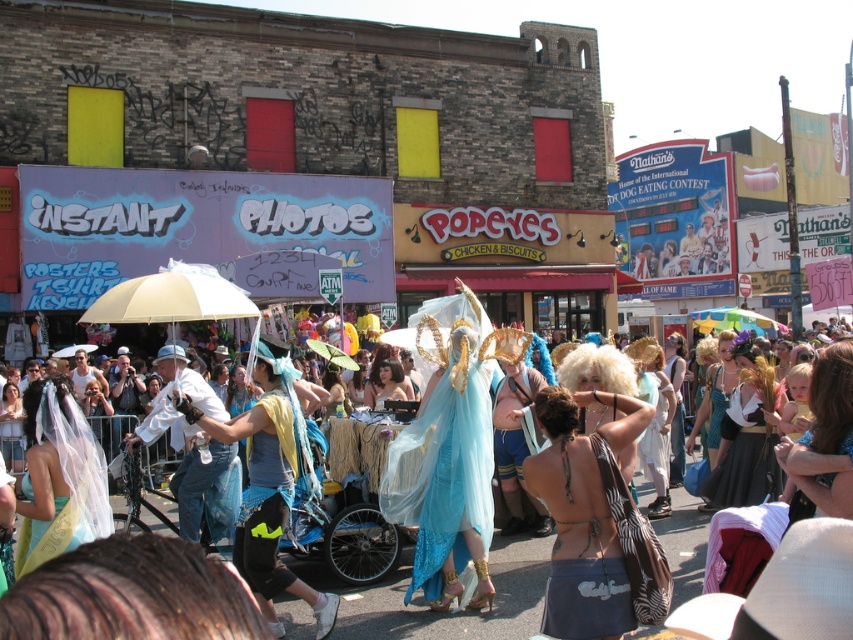
You are standing in the middle of the crowd and see both the white matte umbrella at center and the rainbow fabric umbrella at center. Which one is nearer to you?

The white matte umbrella at center is closer to the viewer than the rainbow fabric umbrella at center, so the white matte umbrella at center is nearer to you.

You are a photographer trying to capture the entire scene of the blue fabric dress at center and the rainbow fabric umbrella at center in one shot. Given that the umbrella is larger, which object should you focus on to ensure both are in frame without cropping?

The blue fabric dress at center is smaller than the rainbow fabric umbrella at center, so you should focus on the rainbow fabric umbrella at center to ensure both are in frame without cropping.